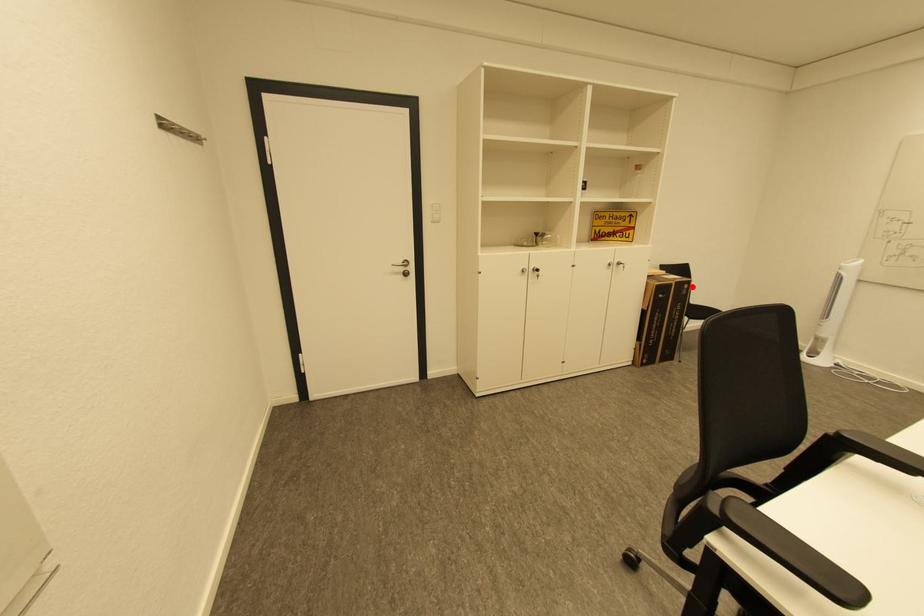
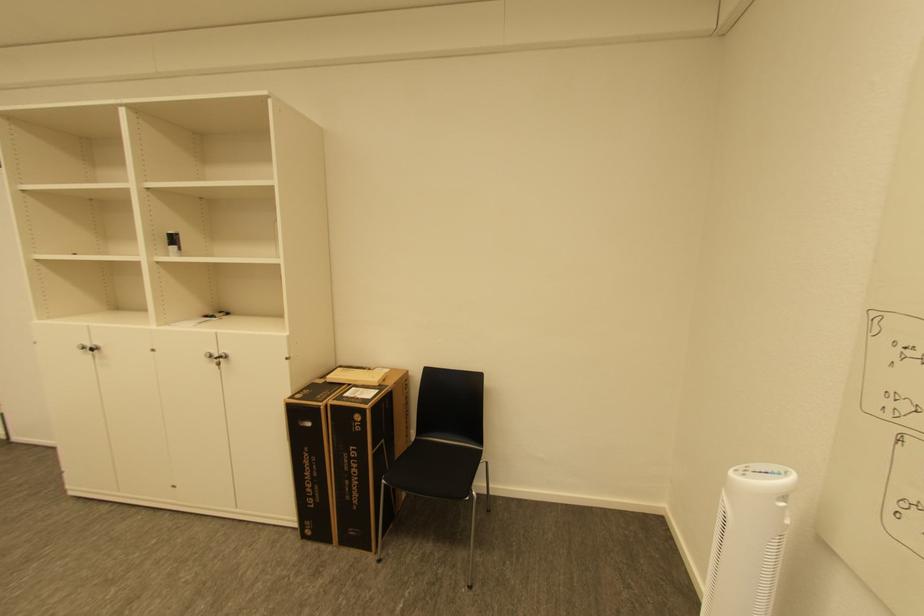
In the second image, find the point that corresponds to the highlighted location in the first image.

(363, 418)